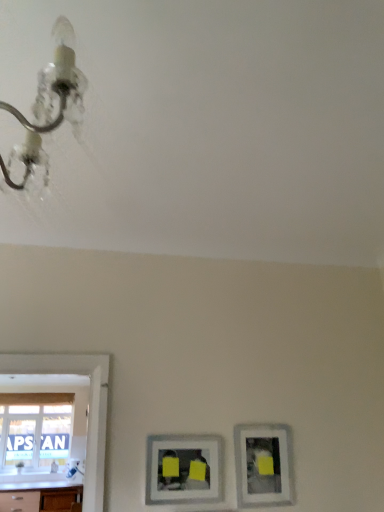
Question: Is matte silver picture frame at lower right, the second picture frame positioned from the left, taller than white glossy countertop at lower left?

Choices:
 (A) no
 (B) yes

Answer: (A)

Question: Is matte silver picture frame at lower right, the second picture frame positioned from the left, to the left of white glossy countertop at lower left from the viewer's perspective?

Choices:
 (A) no
 (B) yes

Answer: (A)

Question: Considering the relative positions of matte silver picture frame at lower right, the second picture frame positioned from the left, and white glossy countertop at lower left in the image provided, is matte silver picture frame at lower right, the second picture frame positioned from the left, to the right of white glossy countertop at lower left from the viewer's perspective?

Choices:
 (A) no
 (B) yes

Answer: (B)

Question: Is matte silver picture frame at lower right, which is counted as the 1th picture frame, starting from the right, wider than white glossy countertop at lower left?

Choices:
 (A) no
 (B) yes

Answer: (A)

Question: Is matte silver picture frame at lower right, which is counted as the 1th picture frame, starting from the right, thinner than white glossy countertop at lower left?

Choices:
 (A) no
 (B) yes

Answer: (B)

Question: Is metallic chandelier at upper left taller or shorter than matte silver picture frame at lower right, which is counted as the 1th picture frame, starting from the right?

Choices:
 (A) tall
 (B) short

Answer: (A)

Question: Based on their sizes in the image, would you say metallic chandelier at upper left is bigger or smaller than matte silver picture frame at lower right, which is counted as the 1th picture frame, starting from the right?

Choices:
 (A) big
 (B) small

Answer: (A)

Question: Is point (41, 77) closer or farther from the camera than point (276, 467)?

Choices:
 (A) closer
 (B) farther

Answer: (A)

Question: From a real-world perspective, is metallic chandelier at upper left positioned above or below matte silver picture frame at lower right, the second picture frame positioned from the left?

Choices:
 (A) above
 (B) below

Answer: (A)

Question: Considering the relative positions of white glossy countertop at lower left and matte silver picture frame at lower center, the second picture frame positioned from the right, in the image provided, is white glossy countertop at lower left to the left or to the right of matte silver picture frame at lower center, the second picture frame positioned from the right,?

Choices:
 (A) left
 (B) right

Answer: (A)

Question: Is white glossy countertop at lower left spatially inside matte silver picture frame at lower center, the second picture frame positioned from the right, or outside of it?

Choices:
 (A) inside
 (B) outside

Answer: (B)

Question: From the image's perspective, is white glossy countertop at lower left above or below matte silver picture frame at lower center, the second picture frame positioned from the right?

Choices:
 (A) above
 (B) below

Answer: (B)

Question: Is white glossy countertop at lower left in front of or behind matte silver picture frame at lower center, marked as the first picture frame in a left-to-right arrangement, in the image?

Choices:
 (A) front
 (B) behind

Answer: (B)

Question: From the image's perspective, is matte silver picture frame at lower center, the second picture frame positioned from the right, above or below matte silver picture frame at lower right, the second picture frame positioned from the left?

Choices:
 (A) above
 (B) below

Answer: (A)

Question: Is matte silver picture frame at lower center, the second picture frame positioned from the right, in front of or behind matte silver picture frame at lower right, the second picture frame positioned from the left, in the image?

Choices:
 (A) behind
 (B) front

Answer: (B)